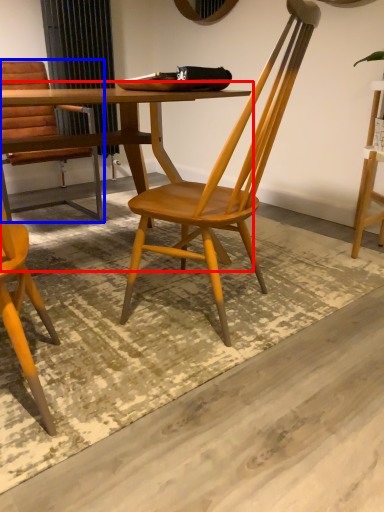
Question: Which point is closer to the camera, table (highlighted by a red box) or chair (highlighted by a blue box)?

Choices:
 (A) table
 (B) chair

Answer: (A)